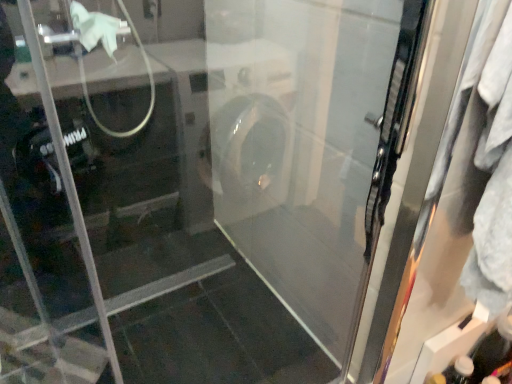
Question: Is transparent plastic bottle at lower right taller than clear glass screen door at right?

Choices:
 (A) yes
 (B) no

Answer: (B)

Question: Does transparent plastic bottle at lower right have a lesser height compared to clear glass screen door at right?

Choices:
 (A) no
 (B) yes

Answer: (B)

Question: Is transparent plastic bottle at lower right wider than clear glass screen door at right?

Choices:
 (A) yes
 (B) no

Answer: (B)

Question: Is transparent plastic bottle at lower right oriented towards clear glass screen door at right?

Choices:
 (A) yes
 (B) no

Answer: (B)

Question: Is the position of transparent plastic bottle at lower right less distant than that of clear glass screen door at right?

Choices:
 (A) yes
 (B) no

Answer: (B)

Question: From a real-world perspective, is transparent plastic bottle at lower right over clear glass screen door at right?

Choices:
 (A) yes
 (B) no

Answer: (B)

Question: Considering the relative sizes of clear glass screen door at right and transparent plastic bottle at lower right in the image provided, is clear glass screen door at right smaller than transparent plastic bottle at lower right?

Choices:
 (A) yes
 (B) no

Answer: (B)

Question: From a real-world perspective, is clear glass screen door at right physically below transparent plastic bottle at lower right?

Choices:
 (A) yes
 (B) no

Answer: (B)

Question: Considering the relative sizes of clear glass screen door at right and transparent plastic bottle at lower right in the image provided, is clear glass screen door at right thinner than transparent plastic bottle at lower right?

Choices:
 (A) no
 (B) yes

Answer: (A)

Question: Is clear glass screen door at right further to camera compared to transparent plastic bottle at lower right?

Choices:
 (A) yes
 (B) no

Answer: (B)

Question: Considering the relative sizes of clear glass screen door at right and transparent plastic bottle at lower right in the image provided, is clear glass screen door at right shorter than transparent plastic bottle at lower right?

Choices:
 (A) yes
 (B) no

Answer: (B)

Question: Is clear glass screen door at right outside of transparent plastic bottle at lower right?

Choices:
 (A) no
 (B) yes

Answer: (B)

Question: From a real-world perspective, is transparent plastic bottle at lower right positioned above or below clear glass screen door at right?

Choices:
 (A) below
 (B) above

Answer: (A)